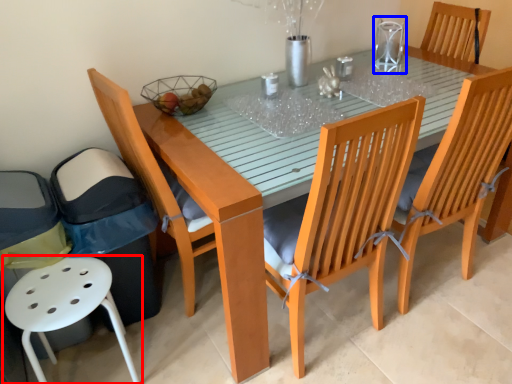
Question: Which object appears closest to the camera in this image, chair (highlighted by a red box) or clear (highlighted by a blue box)?

Choices:
 (A) chair
 (B) clear

Answer: (A)